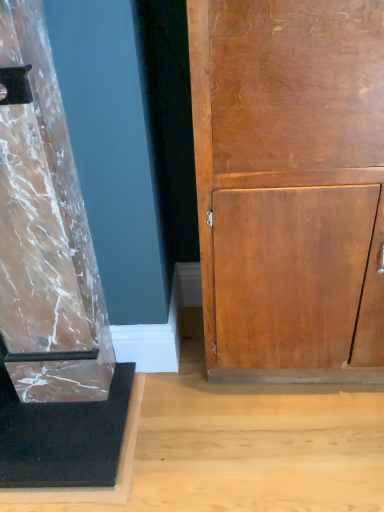
In order to click on free space in front of wooden cupboard at right in this screenshot , I will do `click(298, 446)`.